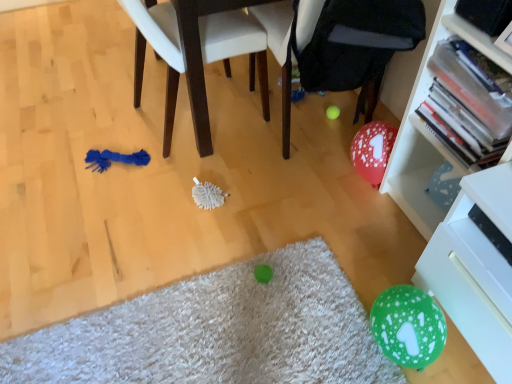
I want to click on free spot to the right of white bristle brush at center, so click(253, 197).